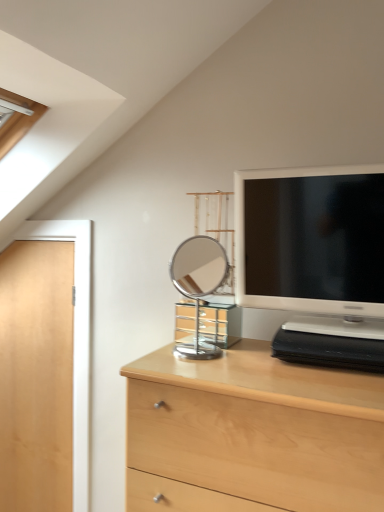
This screenshot has width=384, height=512. I want to click on vacant area in front of polished chrome mirror at center, so click(x=201, y=372).